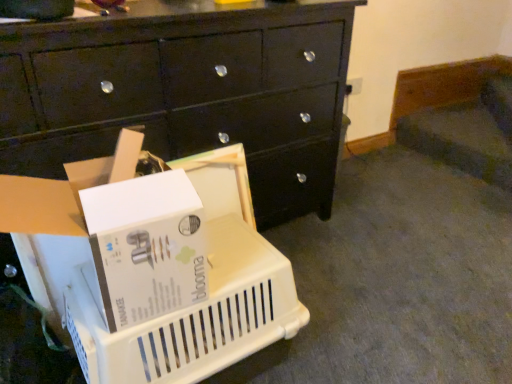
Question: Considering the positions of point (248, 147) and point (96, 261), is point (248, 147) closer or farther from the camera than point (96, 261)?

Choices:
 (A) farther
 (B) closer

Answer: (A)

Question: Which is correct: black glossy chest of drawers at center is inside white plastic basket at lower left, or outside of it?

Choices:
 (A) outside
 (B) inside

Answer: (A)

Question: Which of these objects is positioned farthest from the white plastic storage box at lower left?

Choices:
 (A) black glossy chest of drawers at center
 (B) white plastic basket at lower left

Answer: (A)

Question: Which object is positioned closest to the black glossy chest of drawers at center?

Choices:
 (A) white plastic storage box at lower left
 (B) white plastic basket at lower left

Answer: (B)